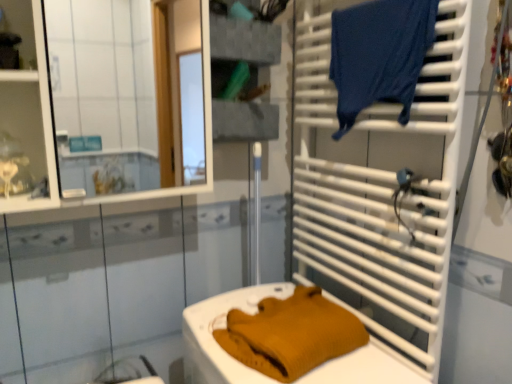
Question: From a real-world perspective, is matte white shelf at upper left, which ranks as the 1th shelf in left-to-right order, beneath white plastic towel rack at right?

Choices:
 (A) no
 (B) yes

Answer: (A)

Question: Is matte white shelf at upper left, which ranks as the 1th shelf in left-to-right order, turned away from white plastic towel rack at right?

Choices:
 (A) yes
 (B) no

Answer: (B)

Question: Does matte white shelf at upper left, placed as the 2th shelf when sorted from right to left, contain white plastic towel rack at right?

Choices:
 (A) no
 (B) yes

Answer: (A)

Question: Is matte white shelf at upper left, acting as the second shelf starting from the back, positioned beyond the bounds of white plastic towel rack at right?

Choices:
 (A) yes
 (B) no

Answer: (A)

Question: Can you confirm if matte white shelf at upper left, which ranks as the 1th shelf in left-to-right order, is positioned to the left of white plastic towel rack at right?

Choices:
 (A) no
 (B) yes

Answer: (B)

Question: Is matte white shelf at upper left, which ranks as the 1th shelf in left-to-right order, to the right of white plastic towel rack at right from the viewer's perspective?

Choices:
 (A) no
 (B) yes

Answer: (A)

Question: From the image's perspective, is white plastic towel rack at right below textured gray fabric at upper center, acting as the second shelf starting from the left?

Choices:
 (A) yes
 (B) no

Answer: (A)

Question: From the image's perspective, is white plastic towel rack at right located above textured gray fabric at upper center, marked as the 1th shelf in a back-to-front arrangement?

Choices:
 (A) yes
 (B) no

Answer: (B)

Question: Considering the relative positions of white plastic towel rack at right and textured gray fabric at upper center, positioned as the second shelf in front-to-back order, in the image provided, is white plastic towel rack at right in front of textured gray fabric at upper center, positioned as the second shelf in front-to-back order,?

Choices:
 (A) yes
 (B) no

Answer: (A)

Question: Can you confirm if white plastic towel rack at right is thinner than textured gray fabric at upper center, which is counted as the first shelf, starting from the right?

Choices:
 (A) yes
 (B) no

Answer: (A)

Question: Considering the relative sizes of white plastic towel rack at right and textured gray fabric at upper center, which is counted as the first shelf, starting from the right, in the image provided, is white plastic towel rack at right shorter than textured gray fabric at upper center, which is counted as the first shelf, starting from the right,?

Choices:
 (A) no
 (B) yes

Answer: (A)

Question: From a real-world perspective, is white plastic towel rack at right on textured gray fabric at upper center, which is counted as the first shelf, starting from the right?

Choices:
 (A) yes
 (B) no

Answer: (B)

Question: From a real-world perspective, is dark blue fabric at upper right on mustard knit sweater at lower center?

Choices:
 (A) no
 (B) yes

Answer: (B)